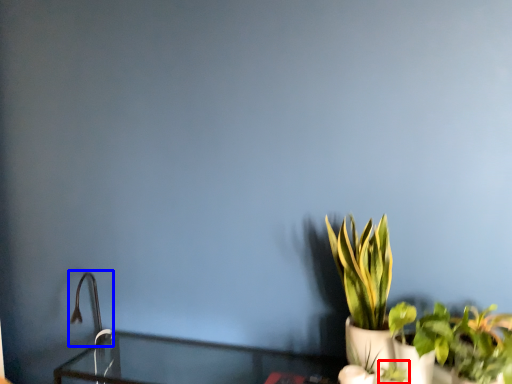
Question: Which object is further to the camera taking this photo, plant (highlighted by a red box) or faucet (highlighted by a blue box)?

Choices:
 (A) plant
 (B) faucet

Answer: (B)